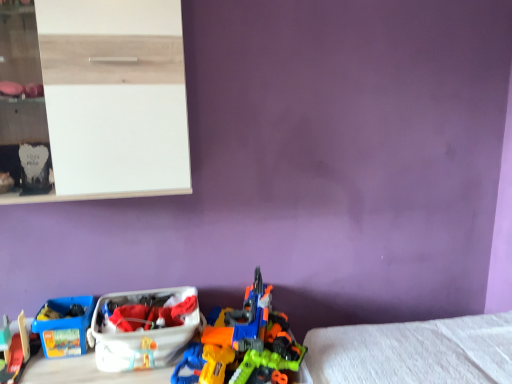
Question: From the image's perspective, would you say blue plastic storage box at lower left, the 1th storage box in the left-to-right sequence, is positioned over white glossy shelf at upper left?

Choices:
 (A) yes
 (B) no

Answer: (B)

Question: Can you confirm if blue plastic storage box at lower left, which is the 2th storage box in right-to-left order, is taller than white glossy shelf at upper left?

Choices:
 (A) no
 (B) yes

Answer: (A)

Question: Is the depth of blue plastic storage box at lower left, which is the 2th storage box in right-to-left order, greater than that of white glossy shelf at upper left?

Choices:
 (A) no
 (B) yes

Answer: (B)

Question: Considering the relative sizes of blue plastic storage box at lower left, which is the 2th storage box in right-to-left order, and white glossy shelf at upper left in the image provided, is blue plastic storage box at lower left, which is the 2th storage box in right-to-left order, wider than white glossy shelf at upper left?

Choices:
 (A) yes
 (B) no

Answer: (B)

Question: Does blue plastic storage box at lower left, the 1th storage box in the left-to-right sequence, have a larger size compared to white glossy shelf at upper left?

Choices:
 (A) yes
 (B) no

Answer: (B)

Question: From their relative heights in the image, would you say white glossy shelf at upper left is taller or shorter than smooth plastic toy train at lower left, the 2th toy when ordered from right to left?

Choices:
 (A) short
 (B) tall

Answer: (B)

Question: Is white glossy shelf at upper left in front of or behind smooth plastic toy train at lower left, which is the first toy from left to right, in the image?

Choices:
 (A) behind
 (B) front

Answer: (B)

Question: From the image's perspective, is white glossy shelf at upper left located above or below smooth plastic toy train at lower left, which is the first toy from left to right?

Choices:
 (A) above
 (B) below

Answer: (A)

Question: Is point (109, 54) positioned closer to the camera than point (23, 367)?

Choices:
 (A) closer
 (B) farther

Answer: (A)

Question: From the image's perspective, relative to orange plastic toy gun at center, the 2th toy positioned from the left, is white plastic storage box at lower left, which appears as the first storage box when viewed from the right, above or below?

Choices:
 (A) below
 (B) above

Answer: (A)

Question: Looking at their shapes, would you say white plastic storage box at lower left, positioned as the 2th storage box in left-to-right order, is wider or thinner than orange plastic toy gun at center, which is the 1th toy in right-to-left order?

Choices:
 (A) wide
 (B) thin

Answer: (B)

Question: Based on their sizes in the image, would you say white plastic storage box at lower left, which appears as the first storage box when viewed from the right, is bigger or smaller than orange plastic toy gun at center, which is the 1th toy in right-to-left order?

Choices:
 (A) small
 (B) big

Answer: (A)

Question: Does point (185, 319) appear closer or farther from the camera than point (246, 339)?

Choices:
 (A) farther
 (B) closer

Answer: (A)

Question: In terms of width, does smooth plastic toy train at lower left, the 2th toy when ordered from right to left, look wider or thinner when compared to white glossy shelf at upper left?

Choices:
 (A) wide
 (B) thin

Answer: (A)

Question: Is smooth plastic toy train at lower left, which is the first toy from left to right, taller or shorter than white glossy shelf at upper left?

Choices:
 (A) short
 (B) tall

Answer: (A)